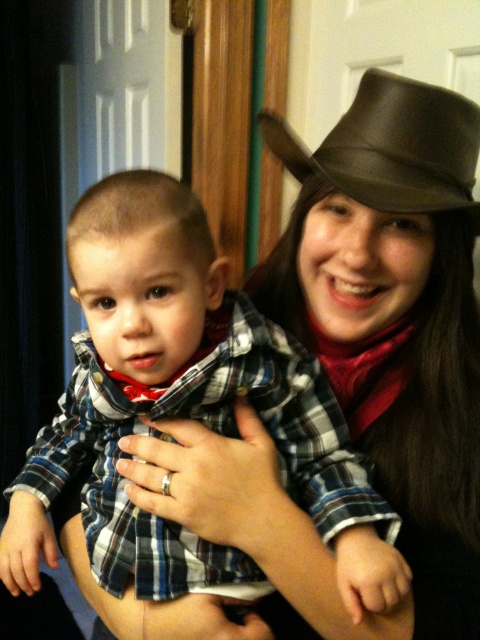
What do you see at coordinates (182, 406) in the screenshot? Image resolution: width=480 pixels, height=640 pixels. I see `plaid fabric shirt at center` at bounding box center [182, 406].

Where is `plaid fabric shirt at center`? This screenshot has height=640, width=480. plaid fabric shirt at center is located at coordinates (182, 406).